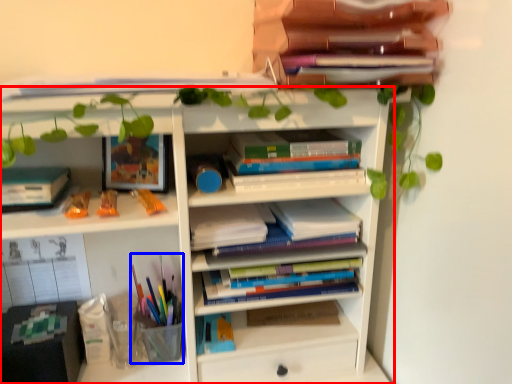
Question: Which of the following is the closest to the observer, shelf (highlighted by a red box) or stationery (highlighted by a blue box)?

Choices:
 (A) shelf
 (B) stationery

Answer: (A)